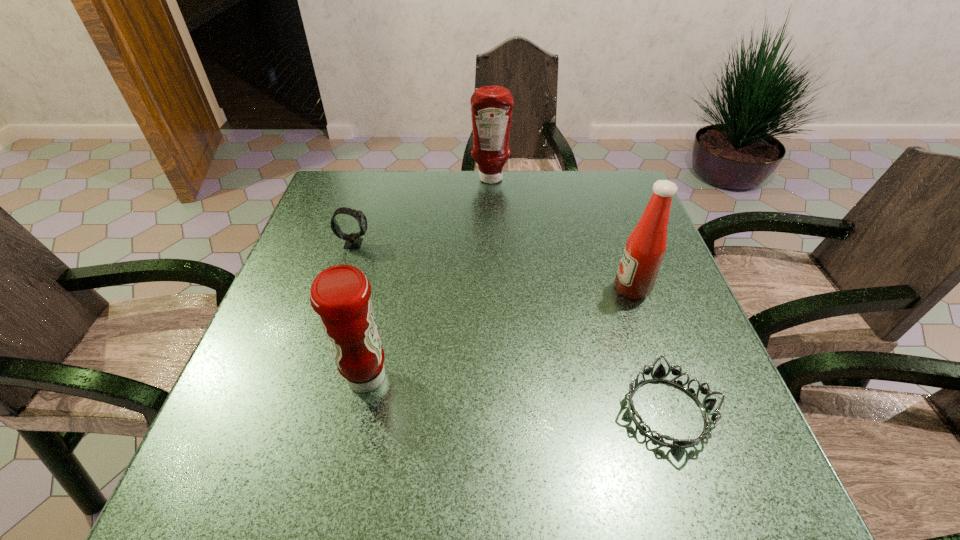
At what (x,y) coordinates should I click in order to perform the action: click on object situated at the left edge. Please return your answer as a coordinate pair (x, y). Looking at the image, I should click on [353, 241].

Where is `condiment present at the right edge`? Image resolution: width=960 pixels, height=540 pixels. condiment present at the right edge is located at coordinates (645, 248).

What are the coordinates of `tiara that is at the right edge` in the screenshot? It's located at (707, 405).

Where is `object that is at the near right corner`? The width and height of the screenshot is (960, 540). object that is at the near right corner is located at coordinates (707, 405).

Where is `free space at the far edge of the desktop`? The width and height of the screenshot is (960, 540). free space at the far edge of the desktop is located at coordinates (428, 214).

The height and width of the screenshot is (540, 960). In the image, there is a desktop. Identify the location of free space at the near edge. (570, 503).

Locate an element on the screen. vacant space at the left edge of the desktop is located at coordinates (249, 406).

The width and height of the screenshot is (960, 540). Identify the location of free space at the right edge. (615, 273).

In the image, there is a desktop. At what (x,y) coordinates should I click in order to perform the action: click on vacant space at the far left corner. Please return your answer as a coordinate pair (x, y). Looking at the image, I should click on (328, 195).

Identify the location of free point between the leftmost condiment and the third nearest object. (499, 333).